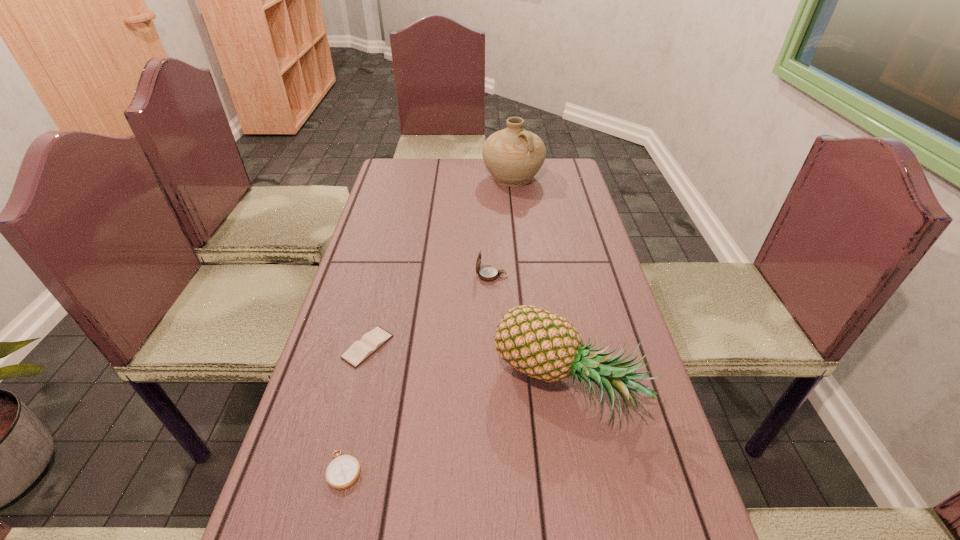
Locate an element on the screen. vacant region located on the face of the right compass is located at coordinates (394, 275).

Where is `free region located 0.200m on the face of the right compass`? This screenshot has height=540, width=960. free region located 0.200m on the face of the right compass is located at coordinates (x=404, y=275).

At what (x,y) coordinates should I click in order to perform the action: click on vacant area located 0.080m on the face of the right compass. Please return your answer as a coordinate pair (x, y). The width and height of the screenshot is (960, 540). Looking at the image, I should click on (447, 275).

I want to click on free space located on the back of the nearer compass, so click(376, 334).

This screenshot has width=960, height=540. I want to click on free spot located 0.050m on the right of the diary, so click(413, 347).

In order to click on object positioned at the far edge in this screenshot , I will do `click(513, 156)`.

This screenshot has width=960, height=540. I want to click on compass present at the left edge, so click(x=343, y=471).

Locate an element on the screen. Image resolution: width=960 pixels, height=540 pixels. diary present at the left edge is located at coordinates (359, 351).

Where is `pottery at the right edge`? The width and height of the screenshot is (960, 540). pottery at the right edge is located at coordinates 513,156.

Find the location of `pineapple located at the right edge`. pineapple located at the right edge is located at coordinates (543, 345).